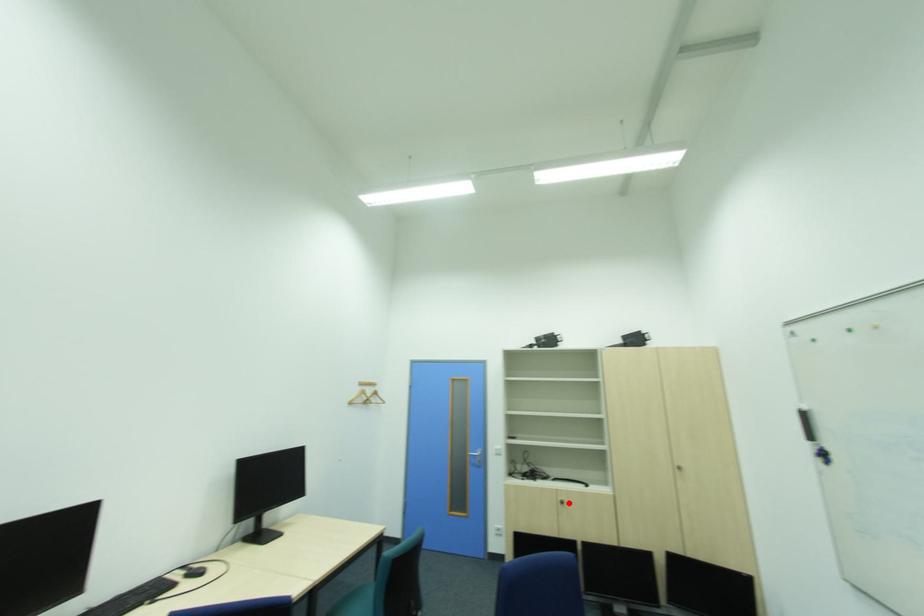
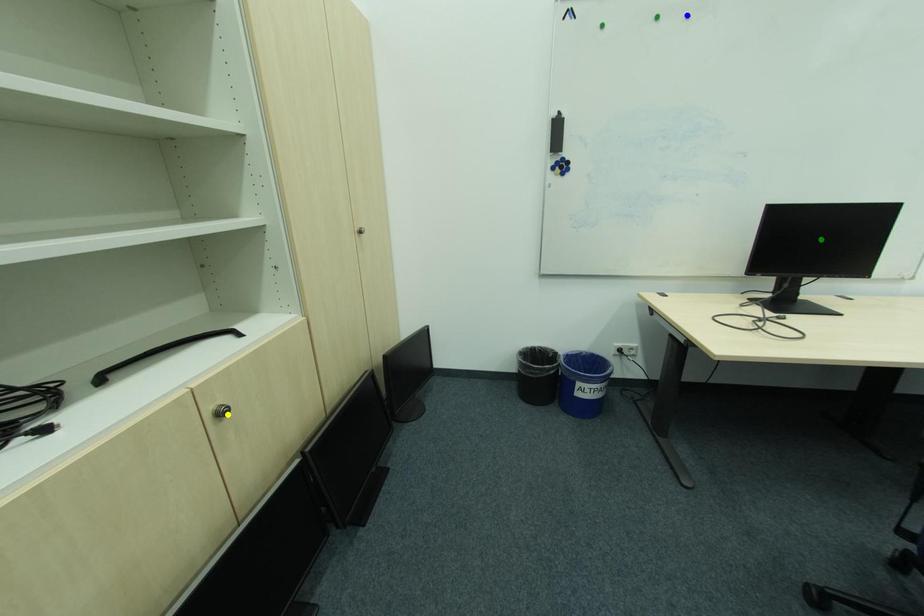
Question: I am providing you with two images of the same scene from different viewpoints. A red point is marked on the first image. You are given multiple points on the second image. Can you choose the point in image 2 that corresponds to the point in image 1?

Choices:
 (A) blue point
 (B) green point
 (C) yellow point

Answer: (C)